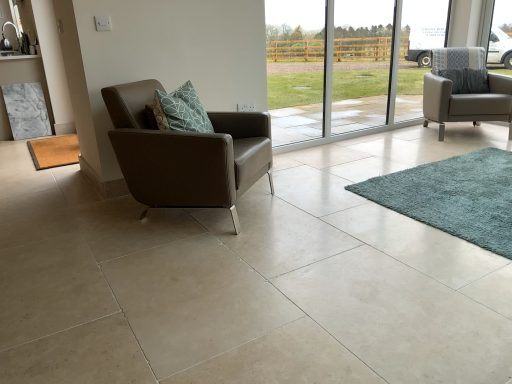
Locate an element on the screen. space that is in front of transparent glass door at center is located at coordinates (396, 166).